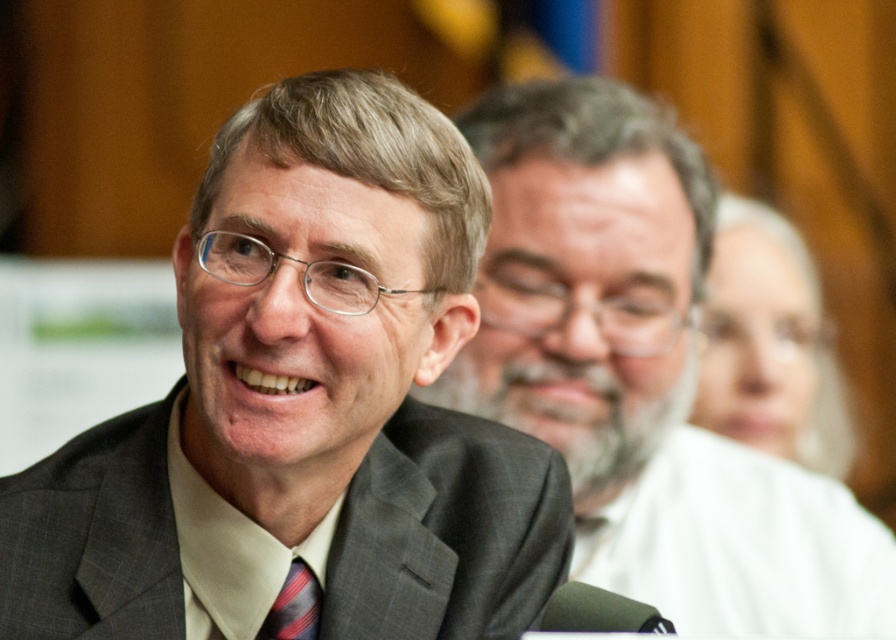
Question: In this image, where is matte gray suit at center located relative to gray suit at center?

Choices:
 (A) left
 (B) right

Answer: (A)

Question: Which of the following is the closest to the observer?

Choices:
 (A) (619, 244)
 (B) (297, 627)

Answer: (B)

Question: Can you confirm if gray suit at center is positioned above dark gray textured suit at center?

Choices:
 (A) no
 (B) yes

Answer: (B)

Question: Which of these objects is positioned closest to the striped fabric tie at center?

Choices:
 (A) dark gray textured suit at center
 (B) matte gray suit at center

Answer: (A)

Question: Based on their relative distances, which object is nearer to the striped fabric tie at center?

Choices:
 (A) matte gray suit at center
 (B) dark gray textured suit at center

Answer: (B)

Question: Does gray suit at center have a lesser width compared to dark gray textured suit at center?

Choices:
 (A) no
 (B) yes

Answer: (A)